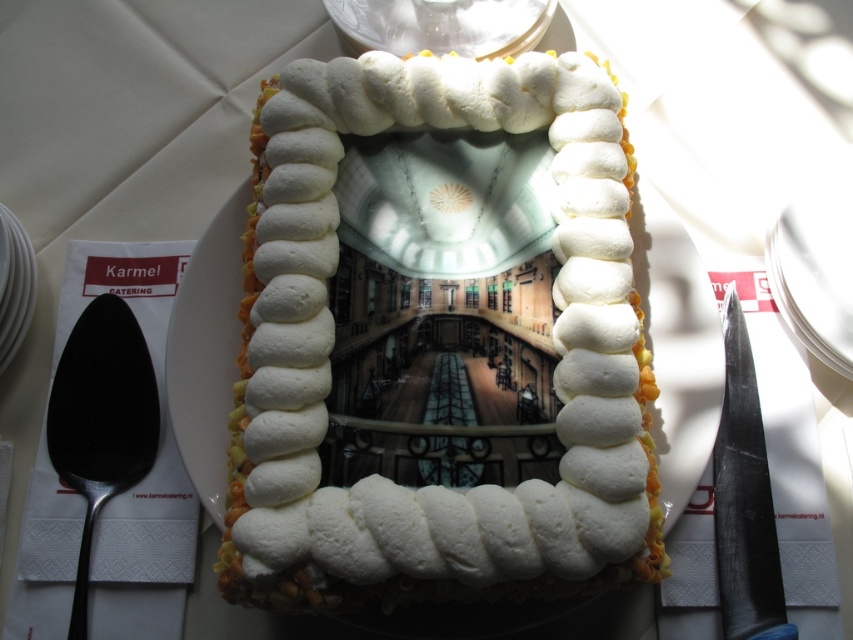
Question: Estimate the real-world distances between objects in this image. Which object is farther from the polished silver spoon at left?

Choices:
 (A) white ceramic plate at left
 (B) white fluffy cake at center

Answer: (B)

Question: Does white paper plate at right appear on the left side of white ceramic plate at left?

Choices:
 (A) no
 (B) yes

Answer: (A)

Question: Which point is closer to the camera taking this photo?

Choices:
 (A) (310, 563)
 (B) (73, 362)

Answer: (A)

Question: Is polished silver spoon at left closer to the viewer compared to white paper plate at right?

Choices:
 (A) yes
 (B) no

Answer: (A)

Question: Which point is farther to the camera?

Choices:
 (A) (840, 371)
 (B) (119, 326)
 (C) (3, 221)
 (D) (289, 472)

Answer: (B)

Question: Is white fluffy cake at center below white paper plate at right?

Choices:
 (A) yes
 (B) no

Answer: (A)